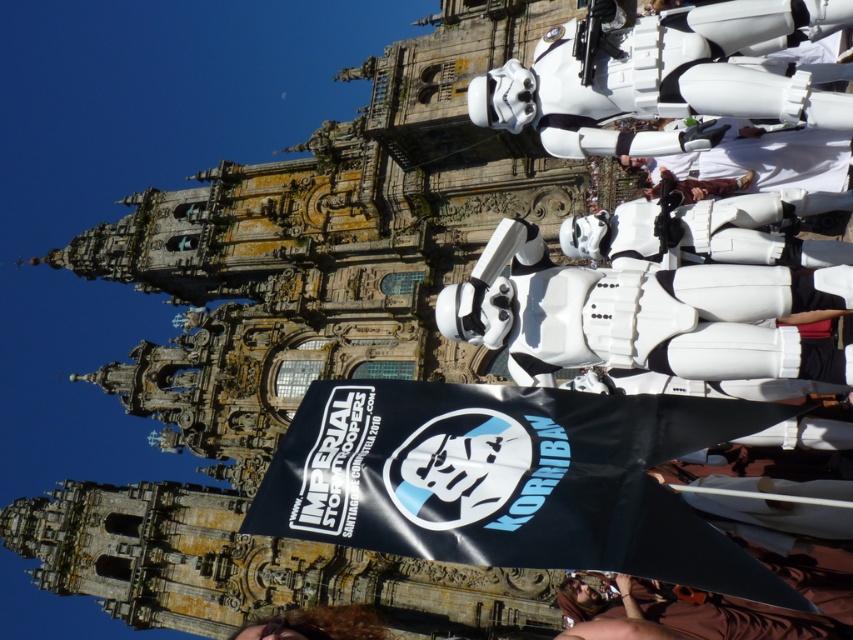
Question: Where is white matte stormtrooper at center located in relation to curly brown hair at lower center in the image?

Choices:
 (A) above
 (B) below

Answer: (A)

Question: Considering the relative positions of white matte stormtrooper at center and curly brown hair at lower center in the image provided, where is white matte stormtrooper at center located with respect to curly brown hair at lower center?

Choices:
 (A) left
 (B) right

Answer: (B)

Question: Which is nearer to the white matte stormtrooper at center?

Choices:
 (A) curly brown hair at lower center
 (B) black fabric flag at center

Answer: (B)

Question: Based on their relative distances, which object is farther from the black fabric flag at center?

Choices:
 (A) curly brown hair at lower center
 (B) white matte stormtrooper at center

Answer: (A)

Question: Among these points, which one is farthest from the camera?

Choices:
 (A) (560, 483)
 (B) (846, 442)

Answer: (B)

Question: Where is black fabric flag at center located in relation to curly brown hair at lower center in the image?

Choices:
 (A) above
 (B) below

Answer: (A)